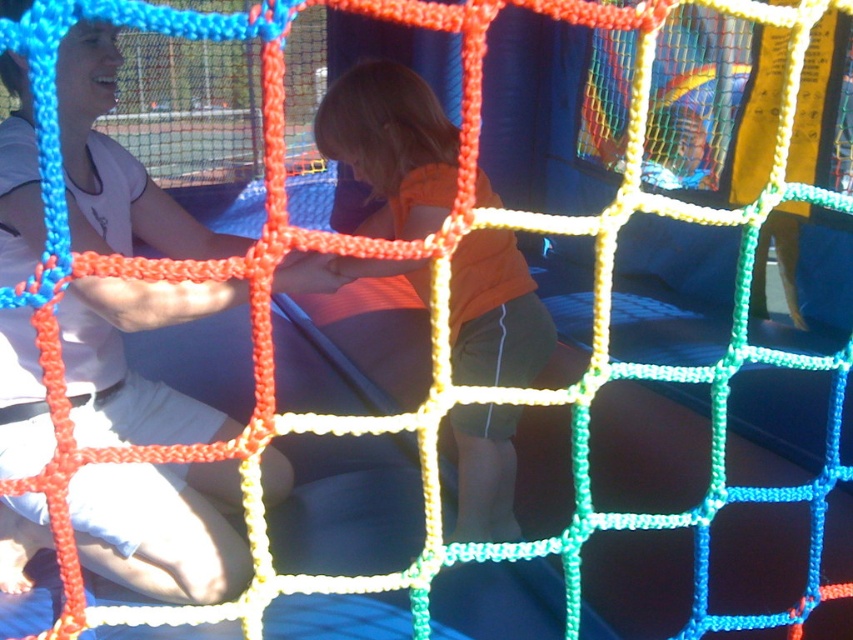
Question: Among these objects, which one is farthest from the camera?

Choices:
 (A) matte white shirt at center
 (B) orange cotton shirt at center

Answer: (B)

Question: Does matte white shirt at center appear under orange cotton shirt at center?

Choices:
 (A) yes
 (B) no

Answer: (A)

Question: Does matte white shirt at center appear under orange cotton shirt at center?

Choices:
 (A) yes
 (B) no

Answer: (A)

Question: Which of the following is the farthest from the observer?

Choices:
 (A) orange cotton shirt at center
 (B) matte white shirt at center

Answer: (A)

Question: Is matte white shirt at center positioned in front of orange cotton shirt at center?

Choices:
 (A) no
 (B) yes

Answer: (B)